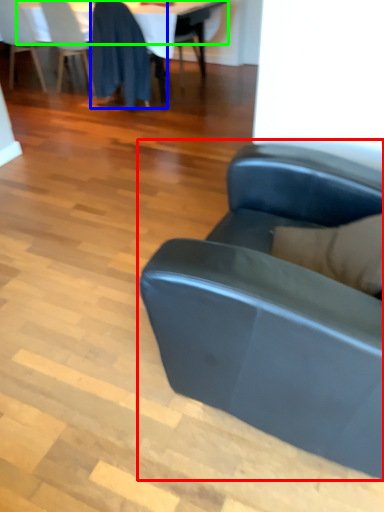
Question: Which is farther away from studio couch (highlighted by a red box)? chair (highlighted by a blue box) or table top (highlighted by a green box)?

Choices:
 (A) chair
 (B) table top

Answer: (B)